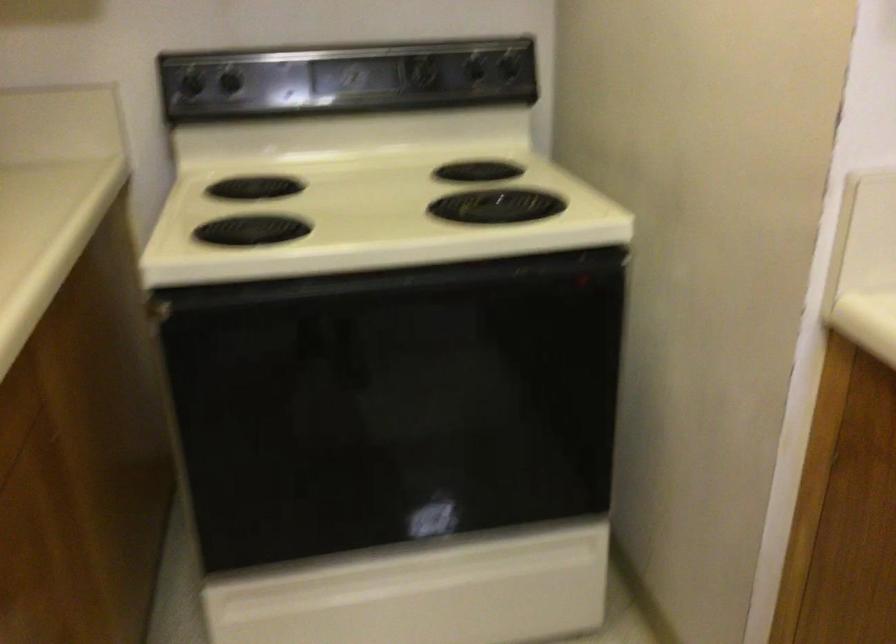
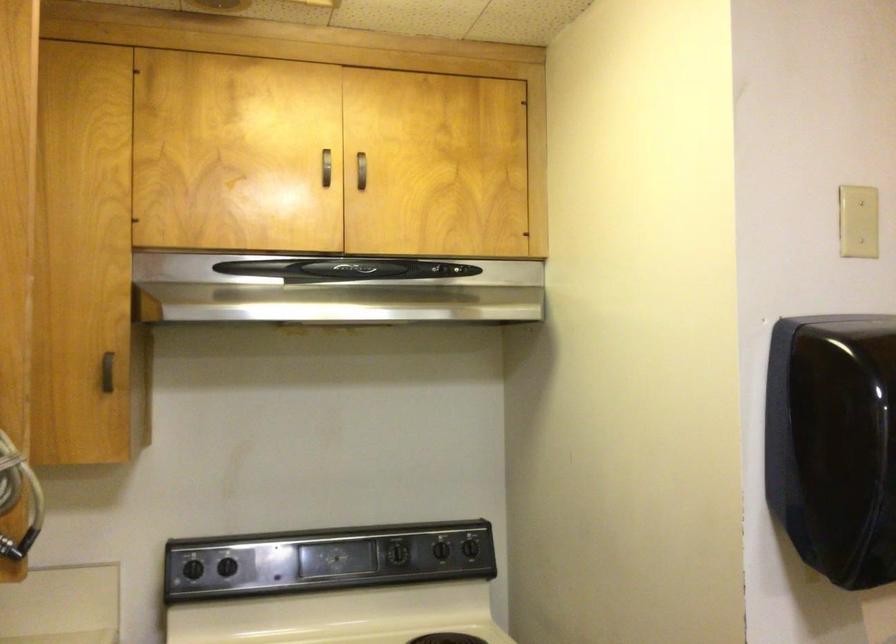
Question: Based on the continuous images, in which direction is the camera rotating? Reply with the corresponding letter.

Choices:
 (A) Left
 (B) Right
 (C) Up
 (D) Down

Answer: (C)